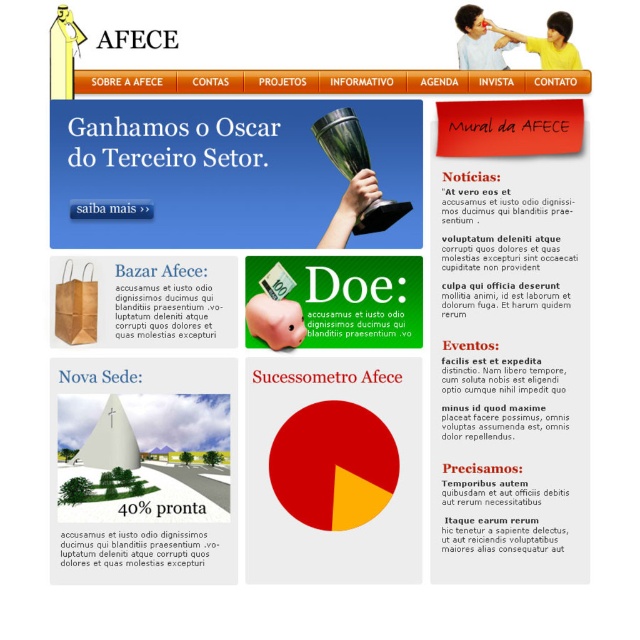
Does point (449, 392) come in front of point (109, 291)?

No, (449, 392) is further to viewer.

Can you confirm if black paper at upper right is smaller than green paper bag at left?

Incorrect, black paper at upper right is not smaller in size than green paper bag at left.

Is point (440, 305) more distant than point (168, 307)?

Yes, it is behind point (168, 307).

Where is `black paper at upper right`? The width and height of the screenshot is (640, 640). black paper at upper right is located at coordinates (509, 356).

Between black paper at upper right and black paper at upper center, which one appears on the left side from the viewer's perspective?

black paper at upper center

Who is more forward, (474, 468) or (164, 563)?

Point (164, 563) is in front.

Image resolution: width=640 pixels, height=640 pixels. What do you see at coordinates (509, 356) in the screenshot?
I see `black paper at upper right` at bounding box center [509, 356].

Where is `black paper at upper right`? black paper at upper right is located at coordinates (509, 356).

Can you confirm if green paper bag at left is positioned to the left of black paper at upper center?

In fact, green paper bag at left is to the right of black paper at upper center.

Is point (212, 316) more distant than point (189, 545)?

That is True.

Describe the element at coordinates (173, 301) in the screenshot. I see `green paper bag at left` at that location.

Image resolution: width=640 pixels, height=640 pixels. What are the coordinates of `green paper bag at left` in the screenshot? It's located at (173, 301).